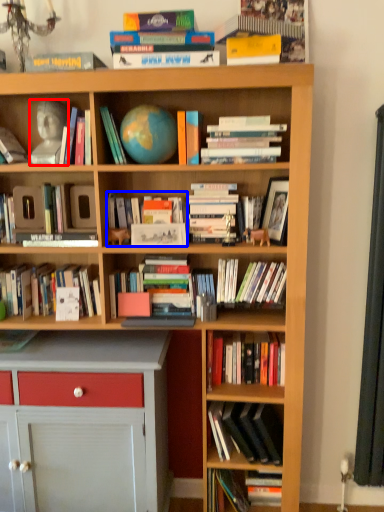
Question: Among these objects, which one is nearest to the camera, person (highlighted by a red box) or book (highlighted by a blue box)?

Choices:
 (A) person
 (B) book

Answer: (A)